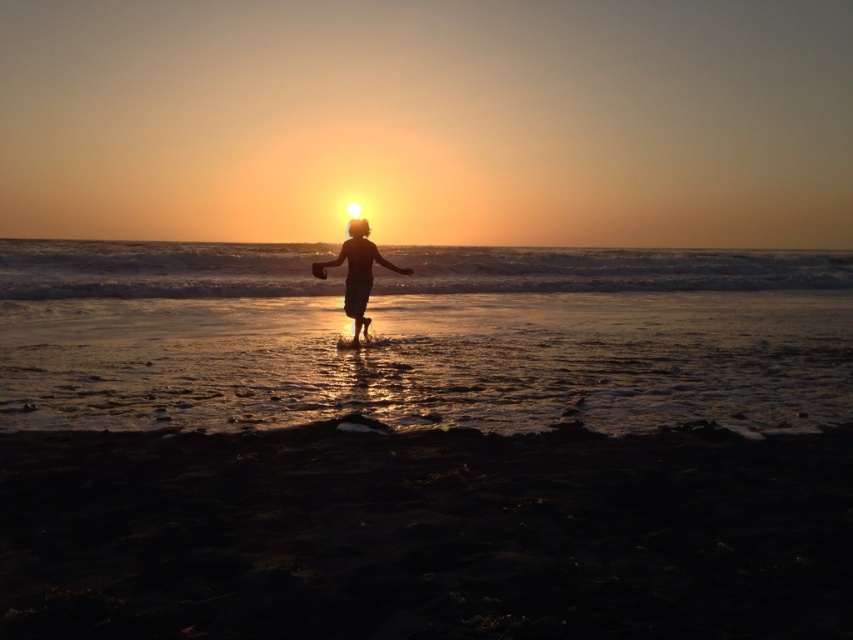
Question: Does dark sand at lower center appear over silhouette wooden stick at center?

Choices:
 (A) no
 (B) yes

Answer: (A)

Question: Which point is farther from the camera taking this photo?

Choices:
 (A) (363, 554)
 (B) (357, 292)

Answer: (B)

Question: Which object appears farthest from the camera in this image?

Choices:
 (A) silhouette wooden stick at center
 (B) dark sand at lower center

Answer: (A)

Question: Does dark sand at lower center have a smaller size compared to silhouette wooden stick at center?

Choices:
 (A) yes
 (B) no

Answer: (A)

Question: Based on their relative distances, which object is nearer to the silhouette wooden stick at center?

Choices:
 (A) shiny wet sand at center
 (B) dark sand at lower center

Answer: (B)

Question: Can you confirm if shiny wet sand at center is positioned above silhouette wooden stick at center?

Choices:
 (A) no
 (B) yes

Answer: (B)